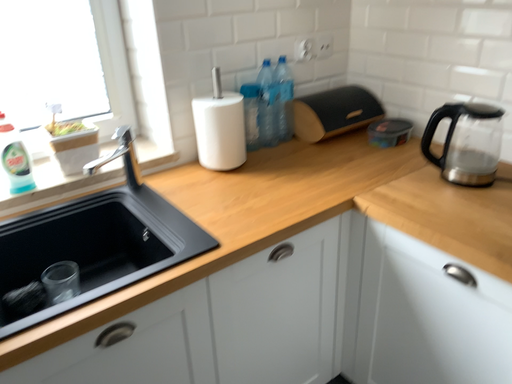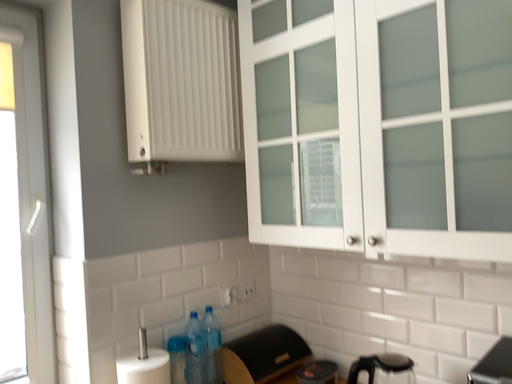
Question: How did the camera likely rotate when shooting the video?

Choices:
 (A) rotated right
 (B) rotated left

Answer: (A)